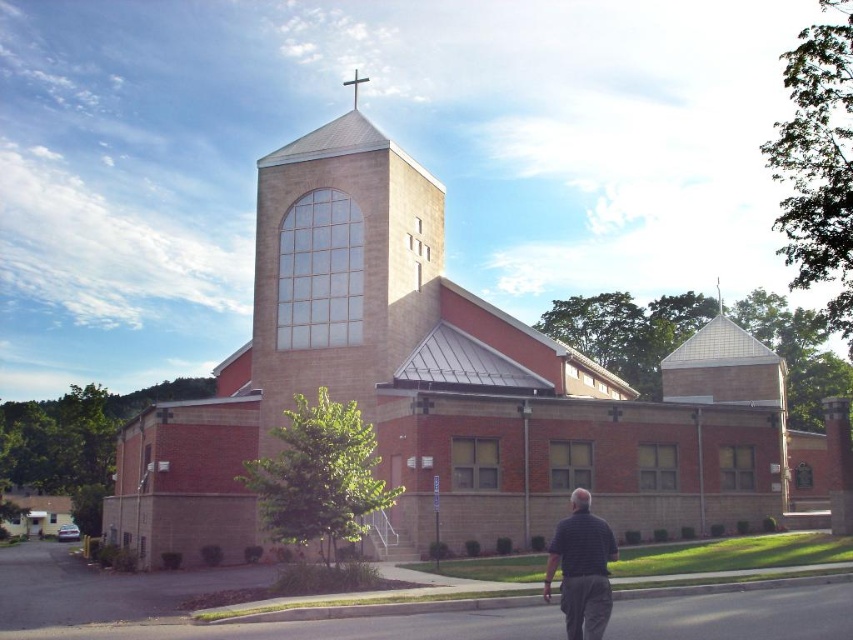
Question: Among these points, which one is nearest to the camera?

Choices:
 (A) (395, 220)
 (B) (610, 556)

Answer: (B)

Question: Is brick church at center below striped shirt at lower right?

Choices:
 (A) no
 (B) yes

Answer: (A)

Question: Is brick church at center bigger than striped shirt at lower right?

Choices:
 (A) no
 (B) yes

Answer: (B)

Question: Can you confirm if brick church at center is smaller than striped shirt at lower right?

Choices:
 (A) no
 (B) yes

Answer: (A)